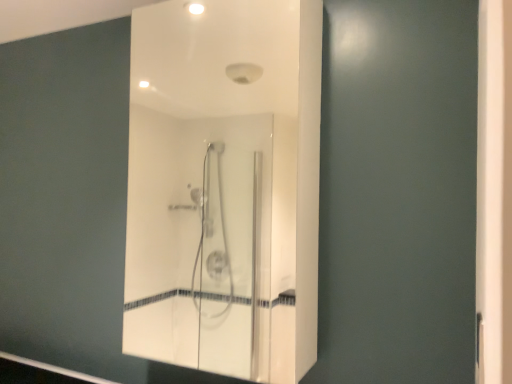
Image resolution: width=512 pixels, height=384 pixels. What do you see at coordinates (224, 186) in the screenshot? I see `white glossy shower at center` at bounding box center [224, 186].

I want to click on white glossy shower at center, so click(224, 186).

The image size is (512, 384). I want to click on white glossy shower at center, so click(224, 186).